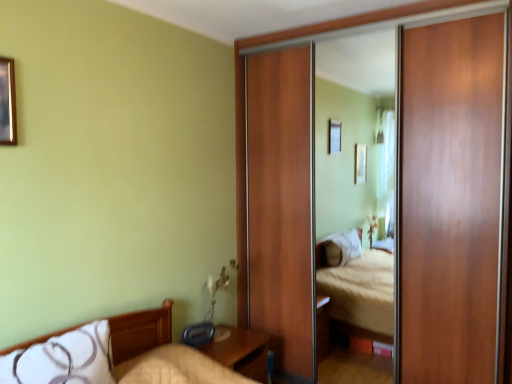
Describe the element at coordinates (253, 131) in the screenshot. I see `wooden sliding door at right` at that location.

The image size is (512, 384). In order to click on wooden sliding door at right in this screenshot , I will do `click(253, 131)`.

Find the location of a particular element. The width and height of the screenshot is (512, 384). wooden picture frame at upper left is located at coordinates (7, 103).

You are a GUI agent. You are given a task and a screenshot of the screen. Output one action in this format:
    pyautogui.click(x=<x>, y=<y>)
    Task: Click on the wooden sliding door at right
    This screenshot has width=512, height=384.
    Given the screenshot: What is the action you would take?
    pyautogui.click(x=253, y=131)

Is wooden picture frame at upper left aimed at white soft pillow at lower left?

No, wooden picture frame at upper left is not aimed at white soft pillow at lower left.

Would you consider wooden picture frame at upper left to be distant from white soft pillow at lower left?

No, there isn't a large distance between wooden picture frame at upper left and white soft pillow at lower left.

Considering the relative sizes of wooden picture frame at upper left and white soft pillow at lower left in the image provided, is wooden picture frame at upper left shorter than white soft pillow at lower left?

No, wooden picture frame at upper left is not shorter than white soft pillow at lower left.

From the image's perspective, is wooden picture frame at upper left positioned above or below white soft pillow at lower left?

Based on their image positions, wooden picture frame at upper left is located above white soft pillow at lower left.

Can you confirm if white soft pillow at lower left is taller than wooden picture frame at upper left?

No.

How different are the orientations of white soft pillow at lower left and wooden picture frame at upper left in degrees?

They differ by 0.835 degrees in their facing directions.

Image resolution: width=512 pixels, height=384 pixels. In order to click on pillow below the wooden picture frame at upper left (from a real-world perspective) in this screenshot , I will do `click(64, 359)`.

From the image's perspective, does wooden picture frame at upper left appear lower than wooden nightstand at lower center?

No.

Is wooden picture frame at upper left in front of or behind wooden nightstand at lower center in the image?

wooden picture frame at upper left is positioned closer to the viewer than wooden nightstand at lower center.

From a real-world perspective, relative to wooden nightstand at lower center, is wooden picture frame at upper left vertically above or below?

wooden picture frame at upper left is above wooden nightstand at lower center.

Is wooden picture frame at upper left thinner than wooden nightstand at lower center?

Indeed, wooden picture frame at upper left has a lesser width compared to wooden nightstand at lower center.

Is wooden picture frame at upper left at the left side of wooden sliding door at right?

Yes.

Is wooden picture frame at upper left far from wooden sliding door at right?

Indeed, wooden picture frame at upper left is not near wooden sliding door at right.

Relative to wooden sliding door at right, is wooden picture frame at upper left in front or behind?

Visually, wooden picture frame at upper left is located in front of wooden sliding door at right.

Measure the distance between wooden picture frame at upper left and wooden sliding door at right.

wooden picture frame at upper left and wooden sliding door at right are 1.96 meters apart.

From the image's perspective, which is above, white soft pillow at lower left or wooden sliding door at right?

wooden sliding door at right.

Do you think white soft pillow at lower left is within wooden sliding door at right, or outside of it?

white soft pillow at lower left is located beyond the bounds of wooden sliding door at right.

From a real-world perspective, is white soft pillow at lower left physically above wooden sliding door at right?

No, from a real-world perspective, white soft pillow at lower left is not on top of wooden sliding door at right.

Is white soft pillow at lower left beside wooden sliding door at right?

white soft pillow at lower left is not next to wooden sliding door at right, and they're not touching.

Considering the relative sizes of white soft pillow at lower left and wooden nightstand at lower center in the image provided, is white soft pillow at lower left thinner than wooden nightstand at lower center?

Yes, white soft pillow at lower left is thinner than wooden nightstand at lower center.

Could you tell me if white soft pillow at lower left is facing wooden nightstand at lower center?

No, white soft pillow at lower left does not turn towards wooden nightstand at lower center.

Is the depth of white soft pillow at lower left greater than that of wooden nightstand at lower center?

No, the depth of white soft pillow at lower left is less than that of wooden nightstand at lower center.

I want to click on pillow above the wooden nightstand at lower center (from the image's perspective), so tap(64, 359).

Considering the points (230, 341) and (94, 340), which point is in front, point (230, 341) or point (94, 340)?

The point (94, 340) is closer.

Is the surface of wooden nightstand at lower center in direct contact with white soft pillow at lower left?

No, wooden nightstand at lower center is not next to white soft pillow at lower left.

Which of these two, wooden nightstand at lower center or white soft pillow at lower left, is bigger?

Bigger between the two is wooden nightstand at lower center.

Which of these two, wooden nightstand at lower center or white soft pillow at lower left, is thinner?

white soft pillow at lower left.

Identify the location of pillow lying on the right of wooden picture frame at upper left. (64, 359).

Locate an element on the screen. picture frame above the white soft pillow at lower left (from a real-world perspective) is located at coordinates (7, 103).

From the image, which object appears to be nearer to wooden picture frame at upper left, wooden nightstand at lower center or white soft pillow at lower left?

Among the two, white soft pillow at lower left is located nearer to wooden picture frame at upper left.

Looking at the image, which one is located closer to white soft pillow at lower left, wooden picture frame at upper left or wooden nightstand at lower center?

wooden nightstand at lower center lies closer to white soft pillow at lower left than the other object.

Considering their positions, is wooden sliding door at right positioned closer to white soft pillow at lower left than wooden nightstand at lower center?

Based on the image, wooden nightstand at lower center appears to be nearer to white soft pillow at lower left.

When comparing their distances from wooden nightstand at lower center, does wooden sliding door at right or white soft pillow at lower left seem closer?

white soft pillow at lower left is closer to wooden nightstand at lower center.

Looking at the image, which one is located further to wooden nightstand at lower center, white soft pillow at lower left or wooden sliding door at right?

wooden sliding door at right is further to wooden nightstand at lower center.

Based on their spatial positions, is white soft pillow at lower left or wooden nightstand at lower center further from wooden picture frame at upper left?

wooden nightstand at lower center.

When comparing their distances from white soft pillow at lower left, does wooden picture frame at upper left or wooden sliding door at right seem further?

The object further to white soft pillow at lower left is wooden sliding door at right.

Considering their positions, is white soft pillow at lower left positioned closer to wooden picture frame at upper left than wooden sliding door at right?

white soft pillow at lower left is closer to wooden picture frame at upper left.

I want to click on pillow between wooden picture frame at upper left and wooden nightstand at lower center from top to bottom, so click(64, 359).

Identify the location of nightstand situated between white soft pillow at lower left and wooden sliding door at right from left to right. (240, 351).

At what (x,y) coordinates should I click in order to perform the action: click on nightstand situated between wooden picture frame at upper left and wooden sliding door at right from left to right. Please return your answer as a coordinate pair (x, y). Looking at the image, I should click on (240, 351).

Where is `pillow between wooden picture frame at upper left and wooden sliding door at right`? The height and width of the screenshot is (384, 512). pillow between wooden picture frame at upper left and wooden sliding door at right is located at coordinates (64, 359).